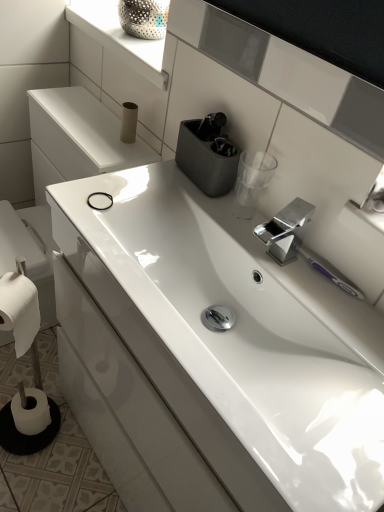
At what (x,y) coordinates should I click in order to perform the action: click on blank space situated above white glossy sink at center (from a real-world perspective). Please return your answer as a coordinate pair (x, y). Looking at the image, I should click on (262, 272).